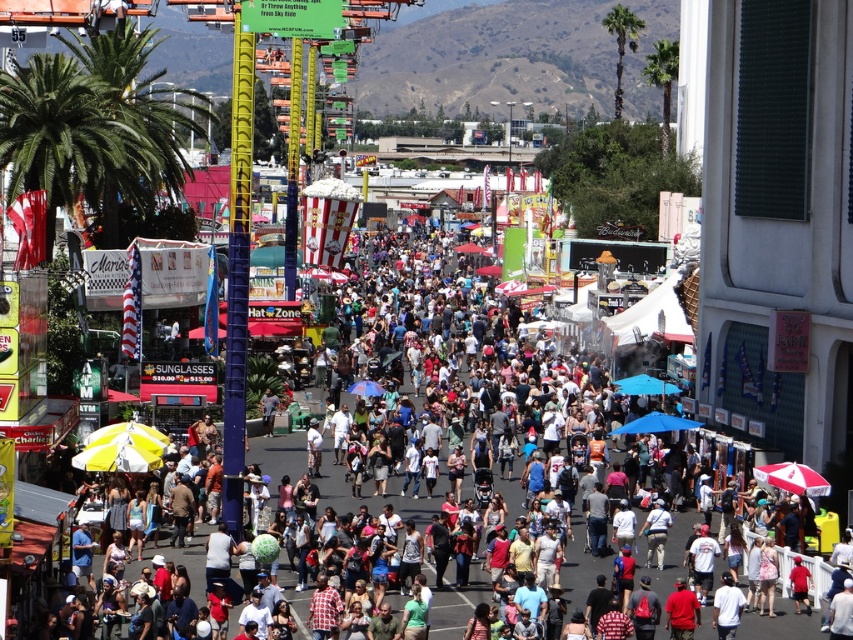
Question: Does green leafy palm tree at upper left have a greater width compared to green leafy palm tree at upper right?

Choices:
 (A) yes
 (B) no

Answer: (B)

Question: Considering the relative positions of green leafy palm tree at left and green leafy palm tree at upper right in the image provided, where is green leafy palm tree at left located with respect to green leafy palm tree at upper right?

Choices:
 (A) right
 (B) left

Answer: (B)

Question: Estimate the real-world distances between objects in this image. Which object is farther from the green leafy palm tree at upper right?

Choices:
 (A) green leafy palm tree at upper left
 (B) green leafy palm tree at left

Answer: (A)

Question: Does green leafy palm tree at left have a smaller size compared to green leafy palm tree at upper right?

Choices:
 (A) yes
 (B) no

Answer: (A)

Question: Which of the following is the closest to the observer?

Choices:
 (A) green leafy palm tree at upper right
 (B) green leafy palm tree at upper left

Answer: (B)

Question: Which is farther from the green leafy palm tree at upper left?

Choices:
 (A) green leafy palm tree at left
 (B) green leafy palm tree at upper right

Answer: (B)